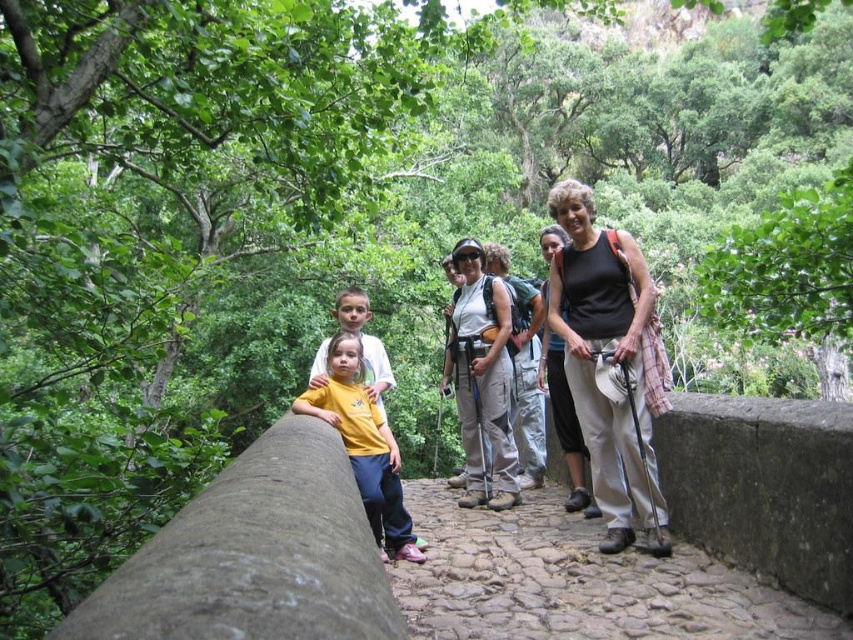
Question: Which object appears farthest from the camera in this image?

Choices:
 (A) cobblestone path at center
 (B) matte white hiking poles at center

Answer: (B)

Question: Can you confirm if cobblestone path at center is positioned below matte black tank top at center?

Choices:
 (A) yes
 (B) no

Answer: (A)

Question: Which point is farther to the camera?

Choices:
 (A) cobblestone path at center
 (B) matte white hiking poles at center
 (C) yellow matte shirt at center
 (D) matte black tank top at center

Answer: (D)

Question: Is cobblestone path at center thinner than yellow matte shirt at center?

Choices:
 (A) no
 (B) yes

Answer: (A)

Question: Which point appears closest to the camera in this image?

Choices:
 (A) (656, 552)
 (B) (531, 579)
 (C) (564, 227)
 (D) (350, 452)

Answer: (B)

Question: Is cobblestone path at center above matte black tank top at center?

Choices:
 (A) yes
 (B) no

Answer: (B)